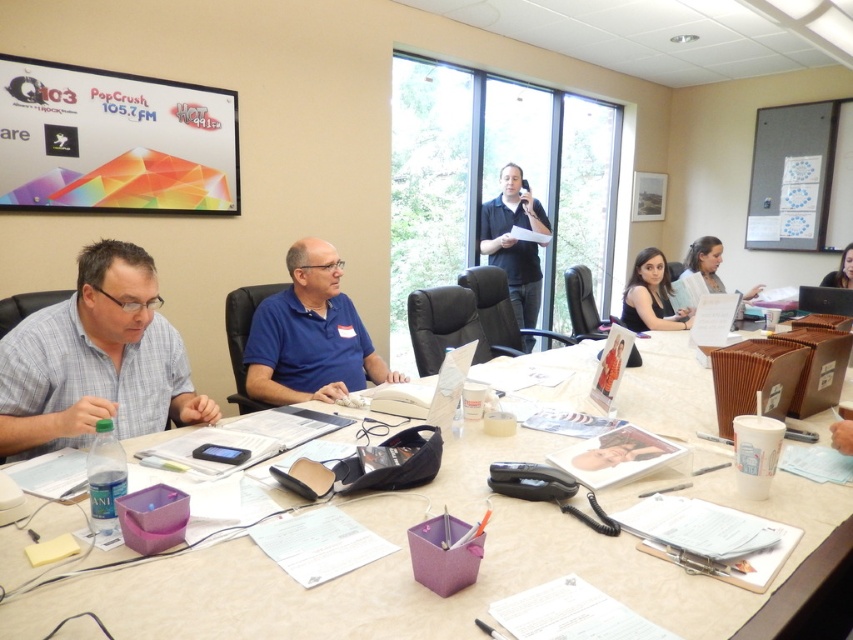
Question: Can you confirm if black fabric shirt at center is positioned below smooth plastic photo frame at center?

Choices:
 (A) yes
 (B) no

Answer: (B)

Question: Which of these objects is positioned closest to the matte black laptop at upper right?

Choices:
 (A) gray checkered shirt at left
 (B) smooth skin face at upper right
 (C) smooth plastic photo frame at center

Answer: (B)

Question: Does white paper at center have a lesser width compared to smooth skin face at upper right?

Choices:
 (A) no
 (B) yes

Answer: (A)

Question: Which of these objects is positioned closest to the matte black laptop at upper right?

Choices:
 (A) smooth skin face at upper right
 (B) smooth plastic photo frame at center

Answer: (A)

Question: Can you confirm if gray checkered shirt at left is positioned above blue cotton shirt at center?

Choices:
 (A) no
 (B) yes

Answer: (A)

Question: Which point is farther to the camera?

Choices:
 (A) matte black laptop at upper right
 (B) smooth skin face at upper right

Answer: (B)